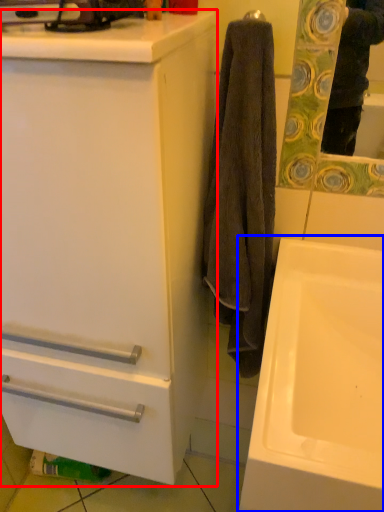
Question: Among these objects, which one is farthest to the camera, bathroom cabinet (highlighted by a red box) or sink (highlighted by a blue box)?

Choices:
 (A) bathroom cabinet
 (B) sink

Answer: (B)